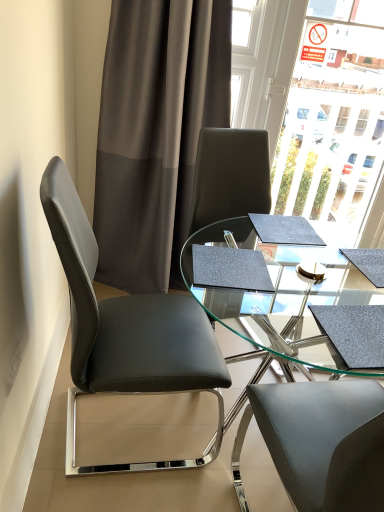
Question: Can you confirm if transparent glass table at center is shorter than black leather chair at left?

Choices:
 (A) yes
 (B) no

Answer: (A)

Question: Is transparent glass table at center taller than black leather chair at left?

Choices:
 (A) no
 (B) yes

Answer: (A)

Question: From a real-world perspective, is transparent glass table at center on black leather chair at left?

Choices:
 (A) yes
 (B) no

Answer: (B)

Question: Considering the relative sizes of transparent glass table at center and black leather chair at left in the image provided, is transparent glass table at center wider than black leather chair at left?

Choices:
 (A) no
 (B) yes

Answer: (B)

Question: From the image's perspective, would you say transparent glass table at center is positioned over black leather chair at left?

Choices:
 (A) yes
 (B) no

Answer: (B)

Question: From a real-world perspective, is transparent glass table at center physically located above or below dark grey sheer curtain at upper left?

Choices:
 (A) below
 (B) above

Answer: (A)

Question: From the image's perspective, is transparent glass table at center above or below dark grey sheer curtain at upper left?

Choices:
 (A) below
 (B) above

Answer: (A)

Question: Is transparent glass table at center bigger or smaller than dark grey sheer curtain at upper left?

Choices:
 (A) big
 (B) small

Answer: (A)

Question: In terms of height, does transparent glass table at center look taller or shorter compared to dark grey sheer curtain at upper left?

Choices:
 (A) tall
 (B) short

Answer: (B)

Question: From their relative heights in the image, would you say dark grey sheer curtain at upper left is taller or shorter than black leather chair at left?

Choices:
 (A) short
 (B) tall

Answer: (B)

Question: From a real-world perspective, is dark grey sheer curtain at upper left positioned above or below black leather chair at left?

Choices:
 (A) above
 (B) below

Answer: (A)

Question: From the image's perspective, is dark grey sheer curtain at upper left located above or below black leather chair at left?

Choices:
 (A) above
 (B) below

Answer: (A)

Question: Is point (125, 161) positioned closer to the camera than point (114, 325)?

Choices:
 (A) farther
 (B) closer

Answer: (A)

Question: Relative to black leather chair at left, is transparent glass table at center in front or behind?

Choices:
 (A) front
 (B) behind

Answer: (B)

Question: Is point (380, 450) positioned closer to the camera than point (210, 352)?

Choices:
 (A) closer
 (B) farther

Answer: (A)